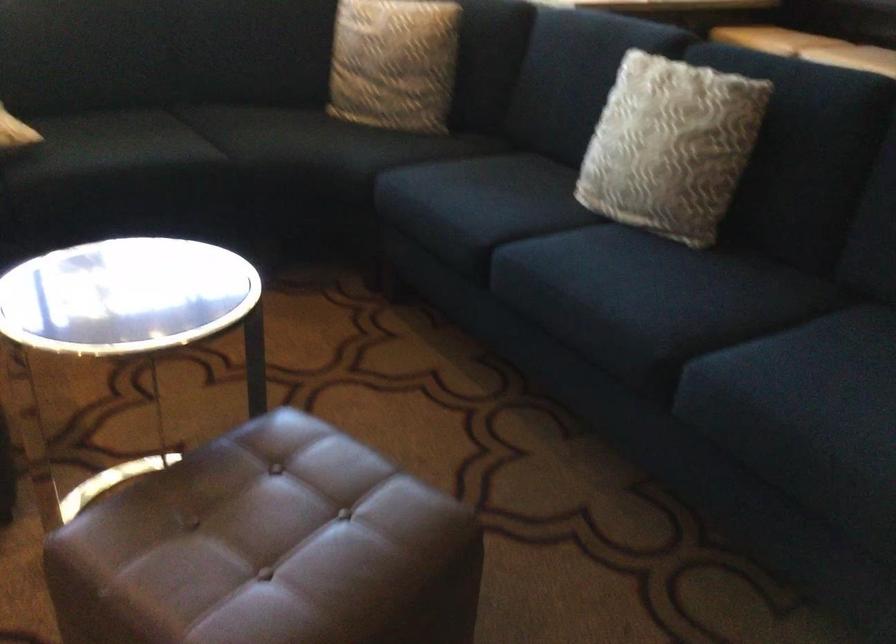
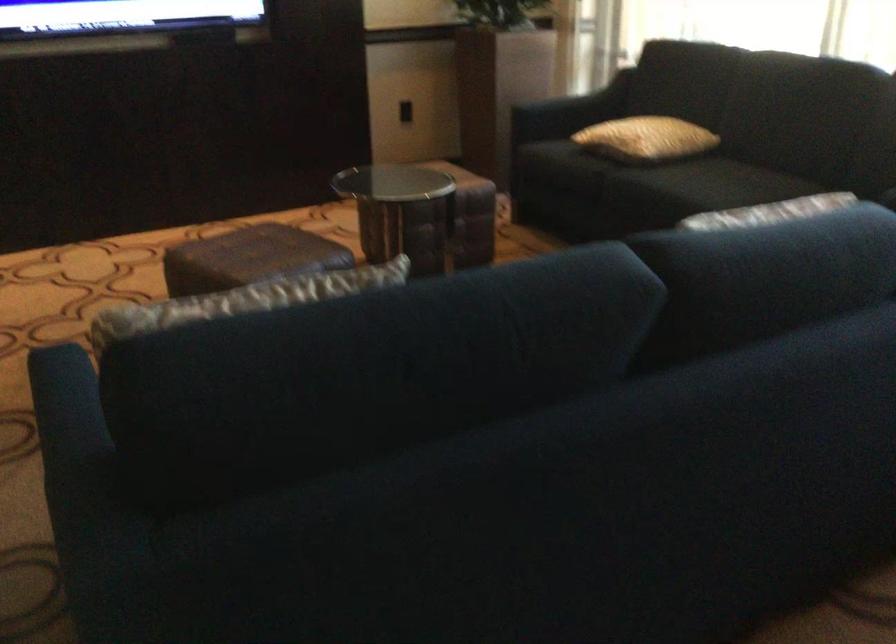
In the second image, find the point that corresponds to (x=150, y=138) in the first image.

(709, 184)